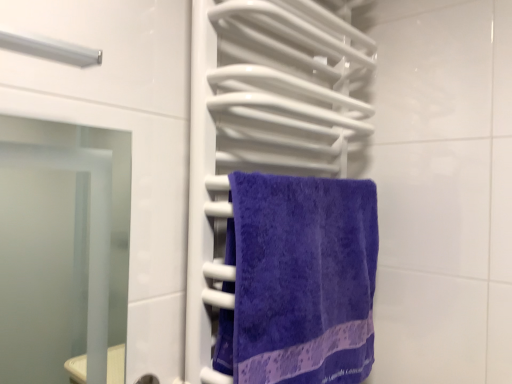
Where is `purple terry cloth towel at center`? purple terry cloth towel at center is located at coordinates (298, 280).

What do you see at coordinates (298, 280) in the screenshot? I see `purple terry cloth towel at center` at bounding box center [298, 280].

Identify the location of purple soft towel at center. This screenshot has height=384, width=512. (261, 125).

What do you see at coordinates (261, 125) in the screenshot? This screenshot has width=512, height=384. I see `purple soft towel at center` at bounding box center [261, 125].

Image resolution: width=512 pixels, height=384 pixels. In order to click on purple terry cloth towel at center in this screenshot , I will do `click(298, 280)`.

Which is more to the right, purple terry cloth towel at center or purple soft towel at center?

purple terry cloth towel at center.

In the image, is purple terry cloth towel at center positioned in front of or behind purple soft towel at center?

In the image, purple terry cloth towel at center appears behind purple soft towel at center.

Considering the positions of point (323, 193) and point (232, 149), is point (323, 193) closer or farther from the camera than point (232, 149)?

Point (323, 193).

From the image's perspective, is purple terry cloth towel at center below purple soft towel at center?

Yes, from the image's perspective, purple terry cloth towel at center is below purple soft towel at center.

From a real-world perspective, is purple terry cloth towel at center beneath purple soft towel at center?

Yes, from a real-world perspective, purple terry cloth towel at center is below purple soft towel at center.

Is purple terry cloth towel at center wider than purple soft towel at center?

Incorrect, the width of purple terry cloth towel at center does not surpass that of purple soft towel at center.

Which of these two, purple terry cloth towel at center or purple soft towel at center, stands shorter?

With less height is purple terry cloth towel at center.

Considering the relative sizes of purple terry cloth towel at center and purple soft towel at center in the image provided, is purple terry cloth towel at center smaller than purple soft towel at center?

Yes, purple terry cloth towel at center is smaller than purple soft towel at center.

Is purple terry cloth towel at center not within purple soft towel at center?

No, purple terry cloth towel at center is not entirely external to purple soft towel at center.

Are purple terry cloth towel at center and purple soft towel at center far apart?

No, purple terry cloth towel at center is in close proximity to purple soft towel at center.

Is purple terry cloth towel at center positioned with its back to purple soft towel at center?

Yes, purple terry cloth towel at center's orientation is away from purple soft towel at center.

Can you tell me how much purple terry cloth towel at center and purple soft towel at center differ in facing direction?

There is a 0.000251-degree angle between the facing directions of purple terry cloth towel at center and purple soft towel at center.

Locate an element on the screen. The width and height of the screenshot is (512, 384). towel directly beneath the purple soft towel at center (from a real-world perspective) is located at coordinates [x=298, y=280].

Considering the relative positions of purple soft towel at center and purple terry cloth towel at center in the image provided, is purple soft towel at center to the right of purple terry cloth towel at center from the viewer's perspective?

No.

Does purple soft towel at center lie behind purple terry cloth towel at center?

No, purple soft towel at center is closer to the camera.

Is point (193, 218) less distant than point (286, 321)?

That is True.

From the image's perspective, is purple soft towel at center located above purple terry cloth towel at center?

Yes, from the image's perspective, purple soft towel at center is above purple terry cloth towel at center.

From a real-world perspective, which object stands above the other?

From a 3D spatial view, purple soft towel at center is above.

Is purple soft towel at center wider or thinner than purple terry cloth towel at center?

Clearly, purple soft towel at center has more width compared to purple terry cloth towel at center.

Between purple soft towel at center and purple terry cloth towel at center, which one has less height?

With less height is purple terry cloth towel at center.

Considering the sizes of objects purple soft towel at center and purple terry cloth towel at center in the image provided, who is bigger, purple soft towel at center or purple terry cloth towel at center?

purple soft towel at center.

Is purple soft towel at center completely or partially outside of purple terry cloth towel at center?

purple soft towel at center is positioned outside purple terry cloth towel at center.

Is purple soft towel at center directly adjacent to purple terry cloth towel at center?

purple soft towel at center is not next to purple terry cloth towel at center, and they're not touching.

Is purple soft towel at center positioned with its back to purple terry cloth towel at center?

Yes.

How many degrees apart are the facing directions of purple soft towel at center and purple terry cloth towel at center?

The angle between the facing direction of purple soft towel at center and the facing direction of purple terry cloth towel at center is 0.000251 degrees.

You are a GUI agent. You are given a task and a screenshot of the screen. Output one action in this format:
    pyautogui.click(x=<x>, y=<y>)
    Task: Click on the closet above the purple terry cloth towel at center (from the image's perspective)
    The width and height of the screenshot is (512, 384).
    Given the screenshot: What is the action you would take?
    pyautogui.click(x=261, y=125)

In order to click on towel behind the purple soft towel at center in this screenshot , I will do `click(298, 280)`.

Find the location of `towel on the right side of purple soft towel at center`. towel on the right side of purple soft towel at center is located at coordinates (298, 280).